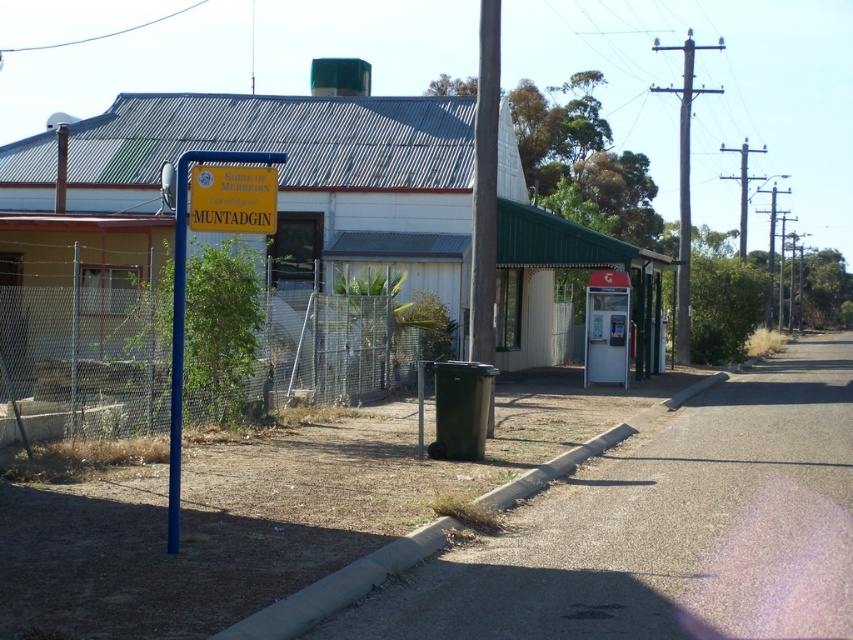
Is wire mesh fence at left further to the viewer compared to blue metallic pole at left?

Yes, wire mesh fence at left is behind blue metallic pole at left.

The width and height of the screenshot is (853, 640). What do you see at coordinates (277, 339) in the screenshot? I see `wire mesh fence at left` at bounding box center [277, 339].

Which is in front, point (25, 321) or point (172, 522)?

Point (172, 522)

Where is `wire mesh fence at left`? This screenshot has height=640, width=853. wire mesh fence at left is located at coordinates (277, 339).

Is smooth wooden pole at center to the right of yellow plastic sign at center-left from the viewer's perspective?

Correct, you'll find smooth wooden pole at center to the right of yellow plastic sign at center-left.

Is smooth wooden pole at center thinner than yellow plastic sign at center-left?

Yes.

The height and width of the screenshot is (640, 853). I want to click on smooth wooden pole at center, so click(485, 186).

Who is positioned more to the right, smooth wooden pole at center or yellow plastic sign at center?

smooth wooden pole at center

Consider the image. Between smooth wooden pole at center and yellow plastic sign at center, which one is positioned higher?

Positioned higher is smooth wooden pole at center.

Measure the distance between point (498,90) and camera.

A distance of 15.79 meters exists between point (498,90) and camera.

Where is `smooth wooden pole at center`? smooth wooden pole at center is located at coordinates (485, 186).